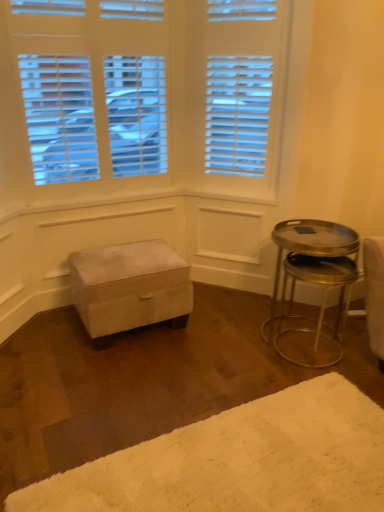
The height and width of the screenshot is (512, 384). I want to click on vacant area on top of white fluffy rug at lower right (from a real-world perspective), so click(x=260, y=457).